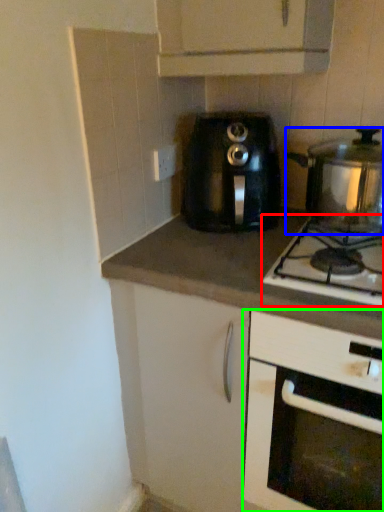
Question: Estimate the real-world distances between objects in this image. Which object is closer to gas stove (highlighted by a red box), kitchen appliance (highlighted by a blue box) or cabinetry (highlighted by a green box)?

Choices:
 (A) kitchen appliance
 (B) cabinetry

Answer: (A)